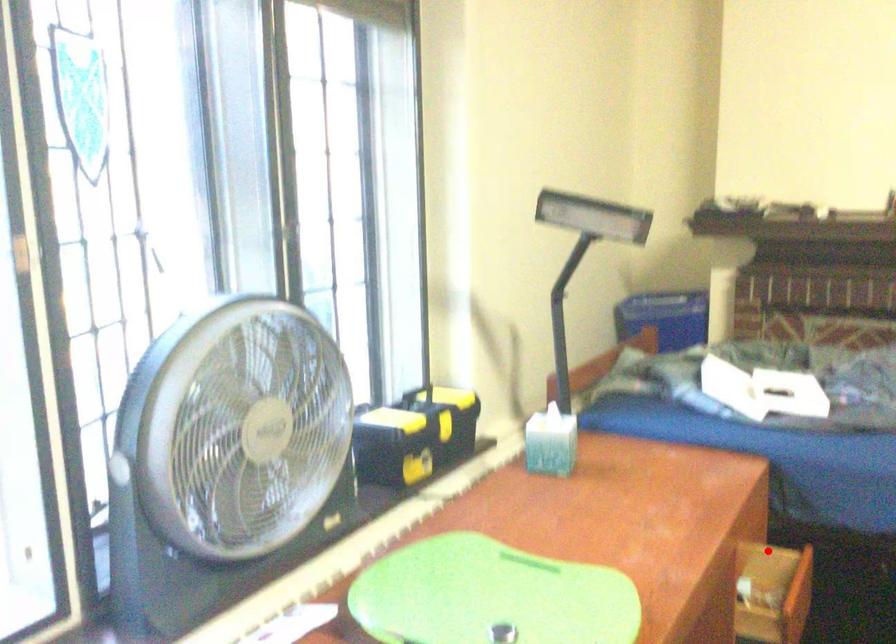
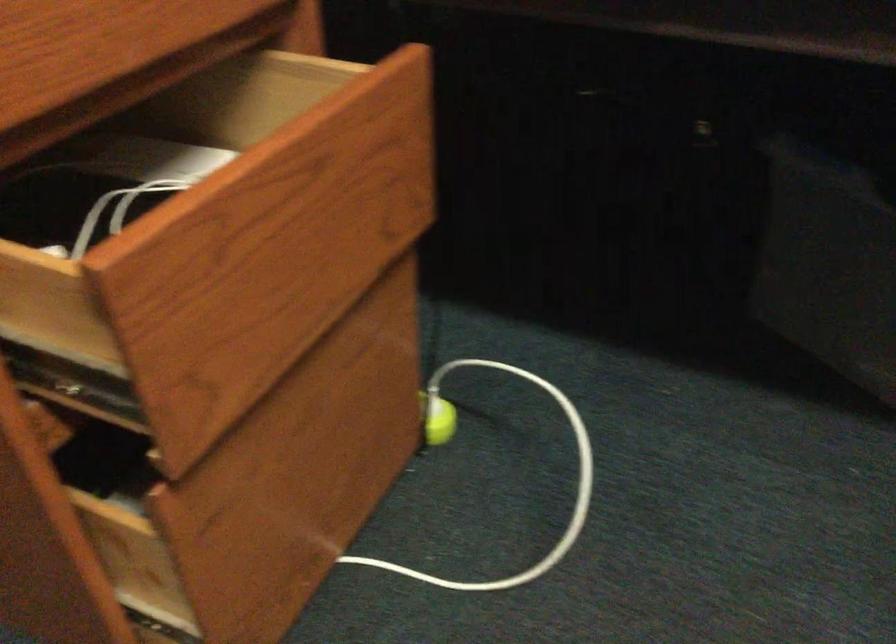
The point at the highlighted location is marked in the first image. Where is the corresponding point in the second image?

(323, 62)